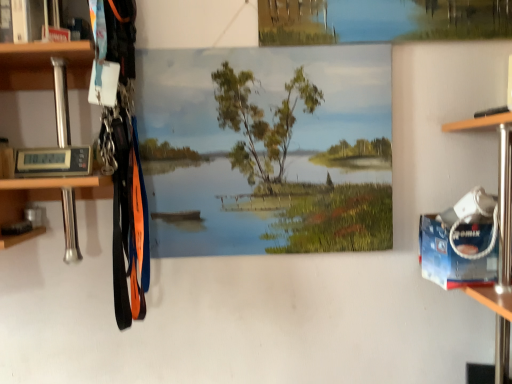
Question: From the image's perspective, is smooth canvas landscape at center below brushed metal cabinet at upper left?

Choices:
 (A) yes
 (B) no

Answer: (A)

Question: From a real-world perspective, is smooth canvas landscape at center beneath brushed metal cabinet at upper left?

Choices:
 (A) no
 (B) yes

Answer: (B)

Question: Is smooth canvas landscape at center positioned with its back to brushed metal cabinet at upper left?

Choices:
 (A) yes
 (B) no

Answer: (B)

Question: Is the depth of smooth canvas landscape at center less than that of brushed metal cabinet at upper left?

Choices:
 (A) yes
 (B) no

Answer: (B)

Question: Is smooth canvas landscape at center wider than brushed metal cabinet at upper left?

Choices:
 (A) yes
 (B) no

Answer: (B)

Question: Is smooth canvas landscape at center at the right side of brushed metal cabinet at upper left?

Choices:
 (A) yes
 (B) no

Answer: (A)

Question: Is smooth canvas landscape at center surrounded by brushed metal cabinet at upper left?

Choices:
 (A) yes
 (B) no

Answer: (B)

Question: Can you confirm if brushed metal cabinet at upper left is shorter than smooth canvas landscape at center?

Choices:
 (A) no
 (B) yes

Answer: (B)

Question: Can you confirm if brushed metal cabinet at upper left is smaller than smooth canvas landscape at center?

Choices:
 (A) yes
 (B) no

Answer: (A)

Question: From the image's perspective, is brushed metal cabinet at upper left on smooth canvas landscape at center?

Choices:
 (A) yes
 (B) no

Answer: (A)

Question: Is brushed metal cabinet at upper left wider than smooth canvas landscape at center?

Choices:
 (A) no
 (B) yes

Answer: (B)

Question: From the image's perspective, is brushed metal cabinet at upper left beneath smooth canvas landscape at center?

Choices:
 (A) no
 (B) yes

Answer: (A)

Question: Choose the correct answer: Is smooth canvas landscape at center inside brushed metal cabinet at upper left or outside it?

Choices:
 (A) outside
 (B) inside

Answer: (A)